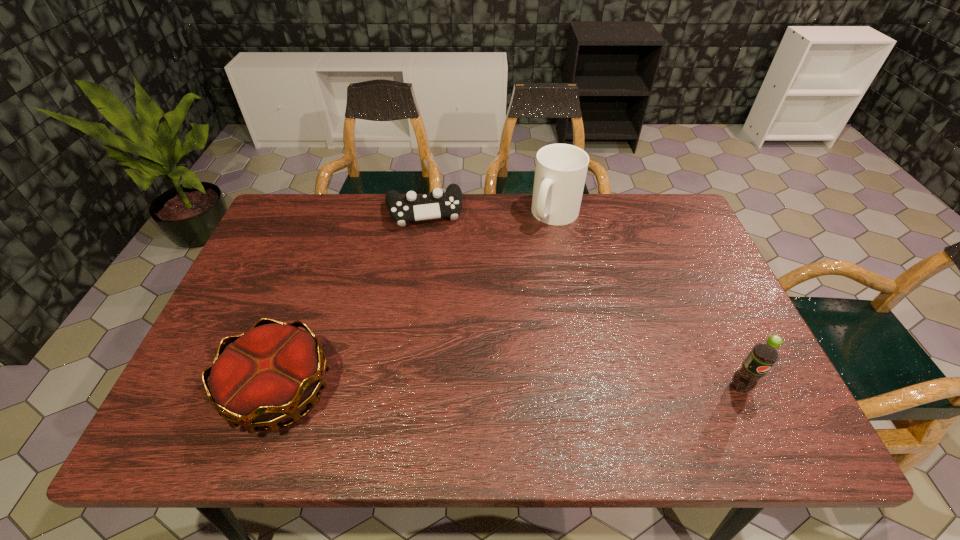
Where is `the leftmost object`? This screenshot has height=540, width=960. the leftmost object is located at coordinates (268, 374).

Find the location of a particular element. crown is located at coordinates (268, 374).

The image size is (960, 540). I want to click on the rightmost object, so click(x=763, y=355).

Where is `the shortest object`? Image resolution: width=960 pixels, height=540 pixels. the shortest object is located at coordinates (413, 207).

Find the location of a particular element. This screenshot has width=960, height=540. control is located at coordinates (413, 207).

Where is `the second object from right to left`? The height and width of the screenshot is (540, 960). the second object from right to left is located at coordinates (560, 172).

You are a GUI agent. You are given a task and a screenshot of the screen. Output one action in this format:
    pyautogui.click(x=<x>, y=<y>)
    Task: Click on the free space located 0.250m on the right of the leftmost object
    This screenshot has height=540, width=960.
    Given the screenshot: What is the action you would take?
    pyautogui.click(x=447, y=391)

Locate an element on the screen. vacant space located on the surface of the control is located at coordinates (431, 242).

The image size is (960, 540). Find the location of `free region located on the surface of the control`. free region located on the surface of the control is located at coordinates (433, 255).

This screenshot has width=960, height=540. Identify the location of vacant area located on the surface of the control. point(435,262).